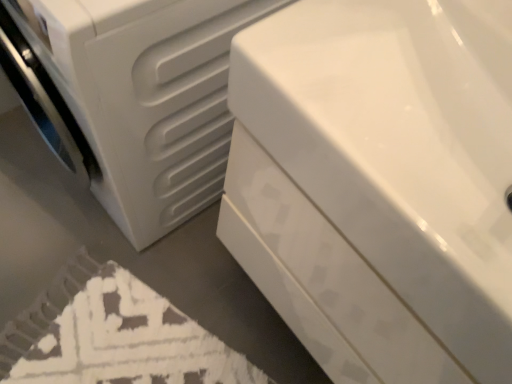
Question: Is white matte washing machine at left taller than white textured bath mat at lower left?

Choices:
 (A) no
 (B) yes

Answer: (B)

Question: Would you say white matte washing machine at left is a long distance from white textured bath mat at lower left?

Choices:
 (A) yes
 (B) no

Answer: (B)

Question: Considering the relative sizes of white matte washing machine at left and white textured bath mat at lower left in the image provided, is white matte washing machine at left smaller than white textured bath mat at lower left?

Choices:
 (A) no
 (B) yes

Answer: (A)

Question: From the image's perspective, is white matte washing machine at left located above white textured bath mat at lower left?

Choices:
 (A) no
 (B) yes

Answer: (B)

Question: Is white matte washing machine at left wider than white textured bath mat at lower left?

Choices:
 (A) yes
 (B) no

Answer: (B)

Question: Does white matte washing machine at left appear on the left side of white textured bath mat at lower left?

Choices:
 (A) no
 (B) yes

Answer: (A)

Question: Would you say white matte washing machine at left contains white glossy bathtub at center?

Choices:
 (A) yes
 (B) no

Answer: (B)

Question: Does white matte washing machine at left lie behind white glossy bathtub at center?

Choices:
 (A) no
 (B) yes

Answer: (B)

Question: Is white matte washing machine at left thinner than white glossy bathtub at center?

Choices:
 (A) yes
 (B) no

Answer: (B)

Question: Does white matte washing machine at left have a smaller size compared to white glossy bathtub at center?

Choices:
 (A) yes
 (B) no

Answer: (B)

Question: From the image's perspective, does white matte washing machine at left appear lower than white glossy bathtub at center?

Choices:
 (A) no
 (B) yes

Answer: (A)

Question: Is white matte washing machine at left to the right of white glossy bathtub at center from the viewer's perspective?

Choices:
 (A) no
 (B) yes

Answer: (A)

Question: Is white textured bath mat at lower left positioned before white matte washing machine at left?

Choices:
 (A) no
 (B) yes

Answer: (A)